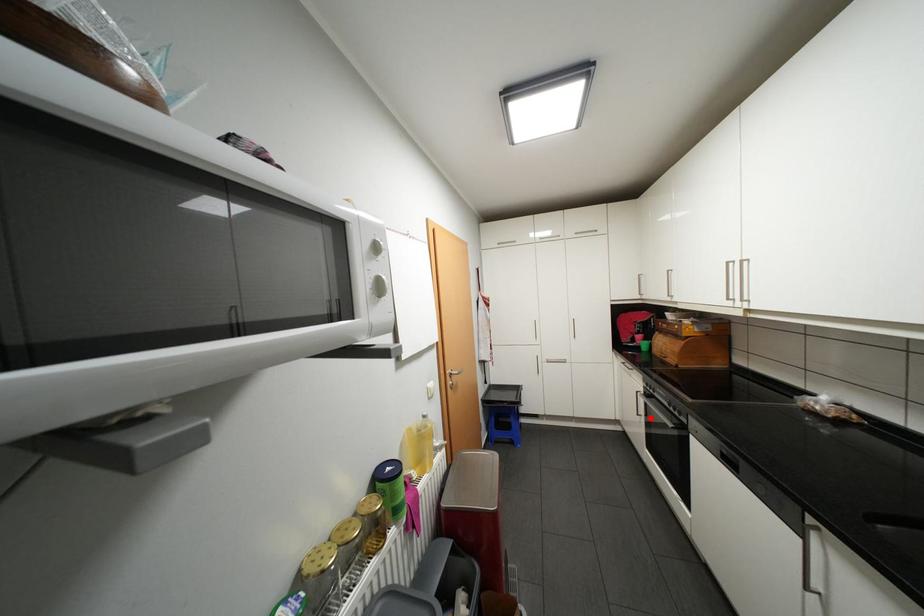
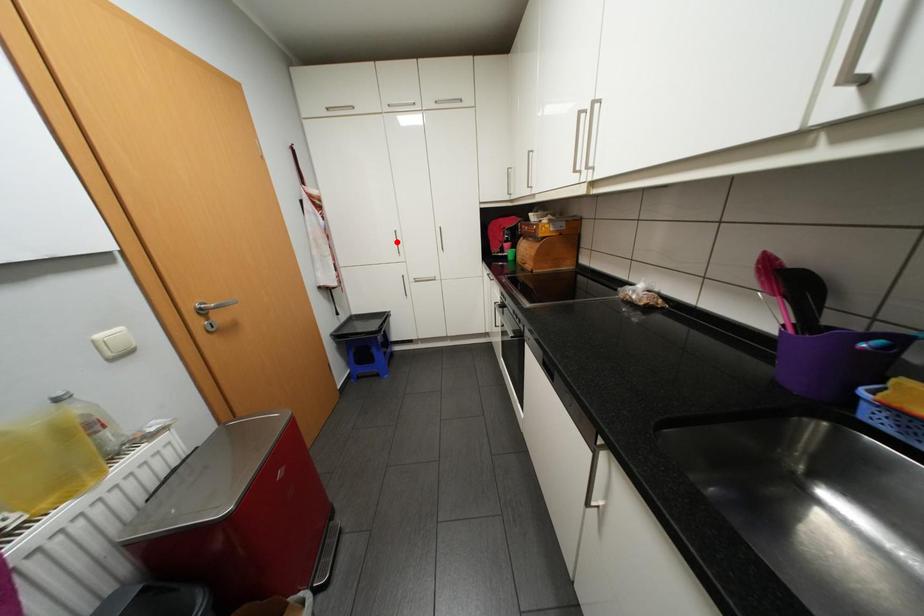
I am providing you with two images of the same scene from different viewpoints. A red point is marked on the first image and another point is marked on the second image. Is the marked point in image1 the same physical position as the marked point in image2?

No